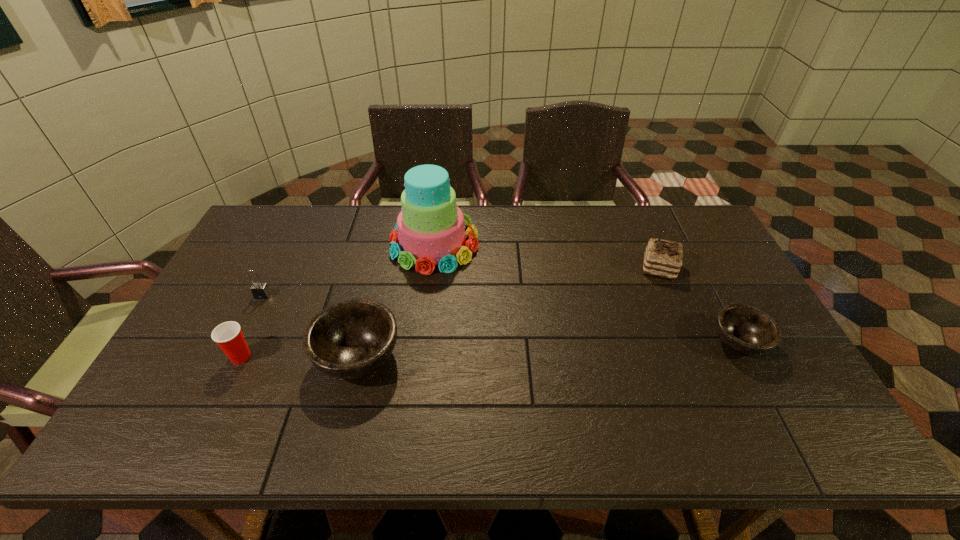
I want to click on free space that satisfies the following two spatial constraints: 1. on the back side of the Dixie cup; 2. on the left side of the chocolate cake, so click(283, 268).

Identify the location of free space that satisfies the following two spatial constraints: 1. on the shackle of the left bowl; 2. on the right side of the padlock. (233, 356).